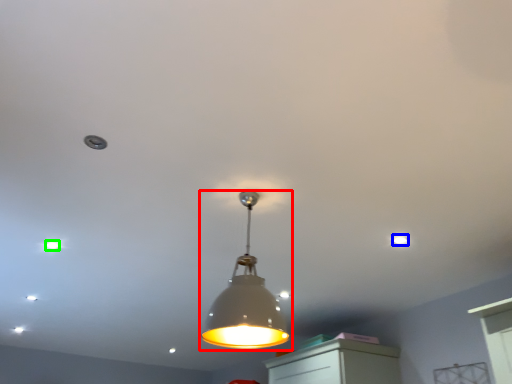
Question: Based on their relative distances, which object is farther from lamp (highlighted by a red box)? Choose from dot (highlighted by a blue box) and dot (highlighted by a green box).

Choices:
 (A) dot
 (B) dot

Answer: (B)